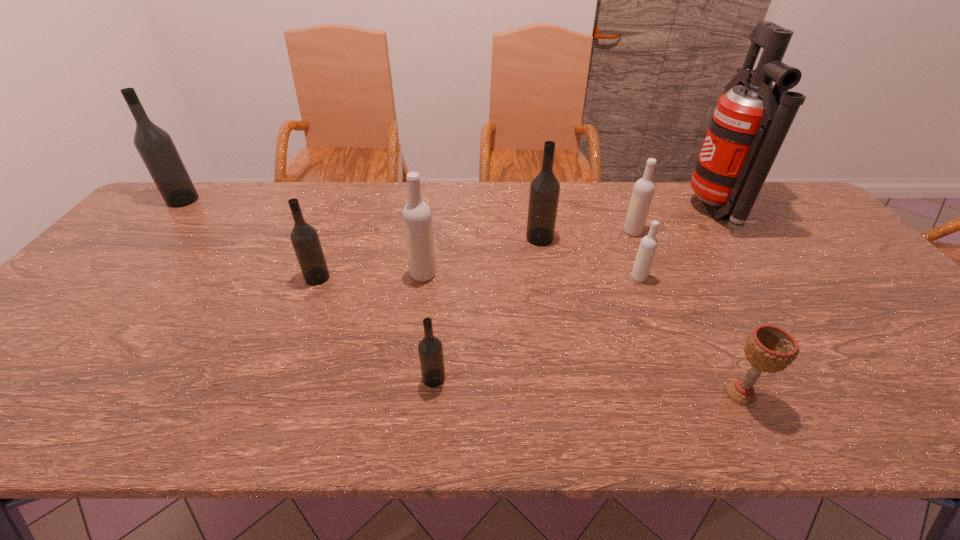
Identify the location of the smallest black vodka. (430, 348).

Find the location of a particular element. the nearest vodka is located at coordinates (430, 348).

Where is `the smallest white vodka`? the smallest white vodka is located at coordinates (648, 245).

The image size is (960, 540). Identify the location of chalice. (768, 348).

Identify the location of the second object from right to left. (768, 348).

This screenshot has width=960, height=540. I want to click on free location located 0.250m on the front label side of the rightmost object, so click(x=609, y=211).

At what (x,y) coordinates should I click in order to perform the action: click on vacant space located on the front label side of the rightmost object. Please return your answer as a coordinate pair (x, y). The height and width of the screenshot is (540, 960). Looking at the image, I should click on (615, 211).

At what (x,y) coordinates should I click in order to perform the action: click on free space located 0.230m on the front label side of the rightmost object. Please return your answer as a coordinate pair (x, y). Looking at the image, I should click on (615, 211).

Locate an element on the screen. vacant space located 0.080m on the right of the leftmost vodka is located at coordinates (222, 200).

The width and height of the screenshot is (960, 540). I want to click on vacant space located on the right of the rightmost black vodka, so tap(631, 238).